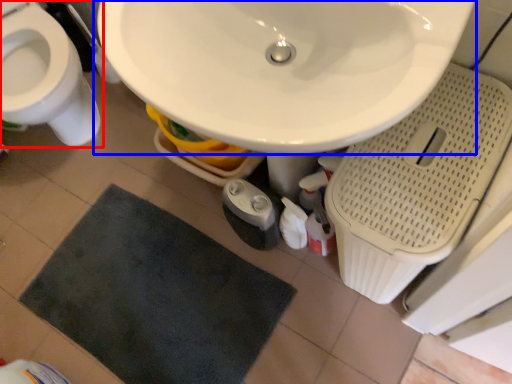
Question: Which object is further to the camera taking this photo, toilet (highlighted by a red box) or sink (highlighted by a blue box)?

Choices:
 (A) toilet
 (B) sink

Answer: (A)